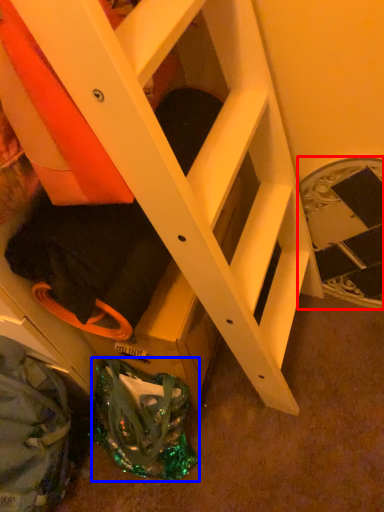
Question: Which object appears farthest to the camera in this image, stairwell (highlighted by a red box) or bag (highlighted by a blue box)?

Choices:
 (A) stairwell
 (B) bag

Answer: (A)